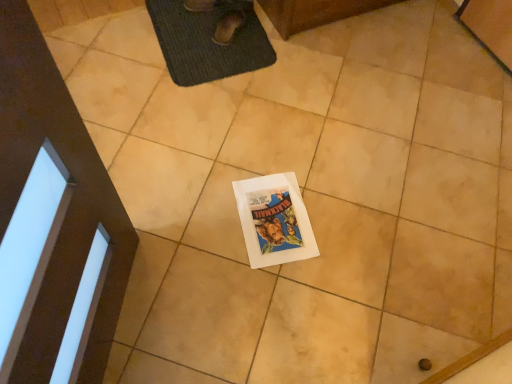
This screenshot has height=384, width=512. What are the coordinates of `blank area beneath white paper comic book at center (from a real-world perspective)` in the screenshot? It's located at (272, 217).